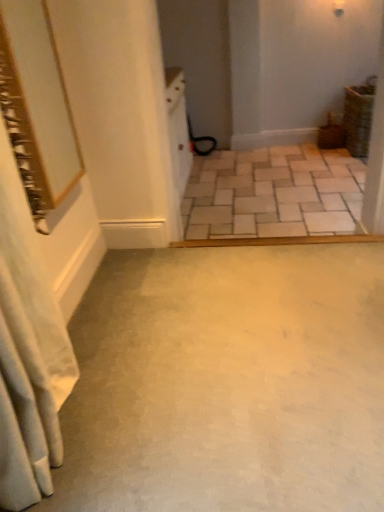
Question: Choose the correct answer: Is beige stone tiles at center, arranged as the first concrete when viewed from the back, inside gold-framed mirror at upper left or outside it?

Choices:
 (A) outside
 (B) inside

Answer: (A)

Question: Is beige stone tiles at center, the 2th concrete in the front-to-back sequence, bigger or smaller than gold-framed mirror at upper left?

Choices:
 (A) big
 (B) small

Answer: (A)

Question: Based on their relative distances, which object is farther from the white fabric shower curtain at left?

Choices:
 (A) smooth concrete floor at center, which is counted as the first concrete, starting from the bottom
 (B) beige stone tiles at center, the 2th concrete in the front-to-back sequence
 (C) gold-framed mirror at upper left

Answer: (B)

Question: Which of these objects is positioned farthest from the gold-framed mirror at upper left?

Choices:
 (A) beige stone tiles at center, the 2th concrete in the front-to-back sequence
 (B) smooth concrete floor at center, acting as the second concrete starting from the top
 (C) white fabric shower curtain at left

Answer: (A)